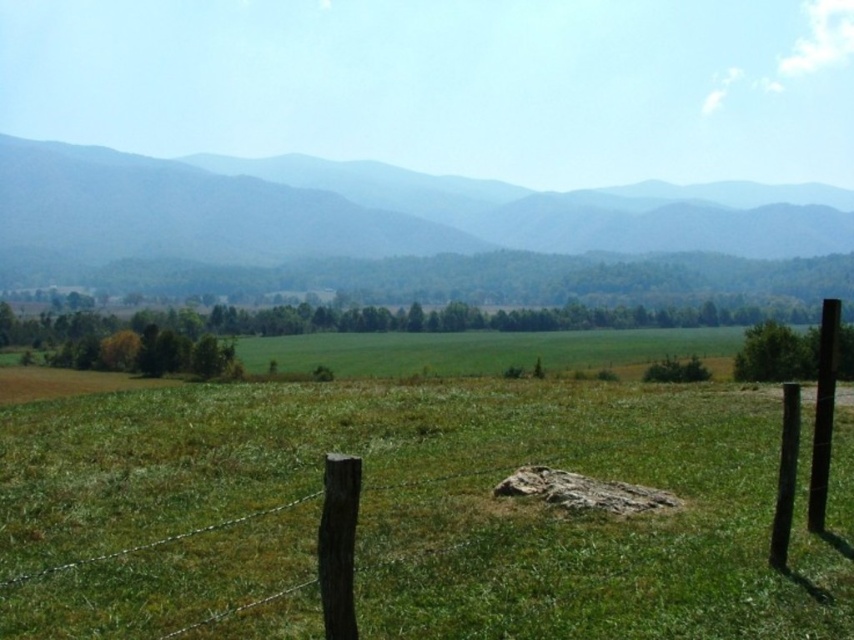
Looking at this image, you are standing in the rural landscape and want to walk from the point at coordinates point [399,202] to the point at coordinates point [810,516]. Which direction should you move in relation to the wooden fence?

Since point [399,202] is closer to you than point [810,516], you should move away from the wooden fence towards the distant mountains to reach the second point.

You are standing at the point marked as point (351,221) in the image. What do you see directly in front of you?

At point (351,221), you see the green forested mountain at upper center directly in front of you.